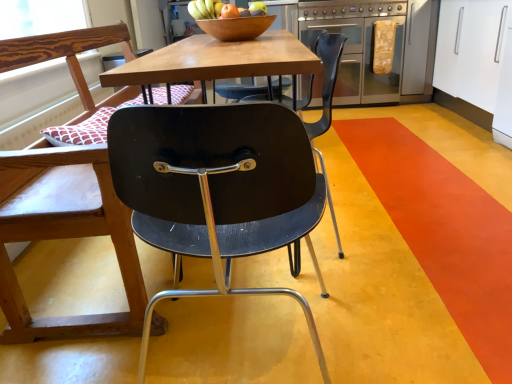
Question: Considering the relative positions of wooden bowl at center and matte black chair at left, which appears as the first chair when viewed from the left, in the image provided, is wooden bowl at center to the left or to the right of matte black chair at left, which appears as the first chair when viewed from the left,?

Choices:
 (A) right
 (B) left

Answer: (A)

Question: Considering the positions of wooden bowl at center and matte black chair at left, which appears as the first chair when viewed from the left, in the image, is wooden bowl at center bigger or smaller than matte black chair at left, which appears as the first chair when viewed from the left,?

Choices:
 (A) big
 (B) small

Answer: (B)

Question: Estimate the real-world distances between objects in this image. Which object is farther from the matte brown apple at center?

Choices:
 (A) shiny wooden bowl at upper center
 (B) white glossy cabinet at upper right
 (C) stainless steel oven at center right
 (D) orange vinyl stripe at lower right
 (E) wooden bowl at center

Answer: (C)

Question: Estimate the real-world distances between objects in this image. Which object is farther from the shiny wooden bowl at upper center?

Choices:
 (A) white glossy cabinet at upper right
 (B) matte brown apple at center
 (C) matte black chair at center, the 1th chair viewed from the right
 (D) wooden bowl at center
 (E) orange vinyl stripe at lower right

Answer: (A)